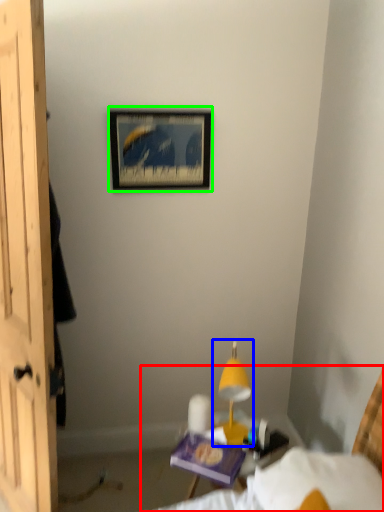
Question: Which is nearer to the bed (highlighted by a red box)? table lamp (highlighted by a blue box) or picture frame (highlighted by a green box).

Choices:
 (A) table lamp
 (B) picture frame

Answer: (A)